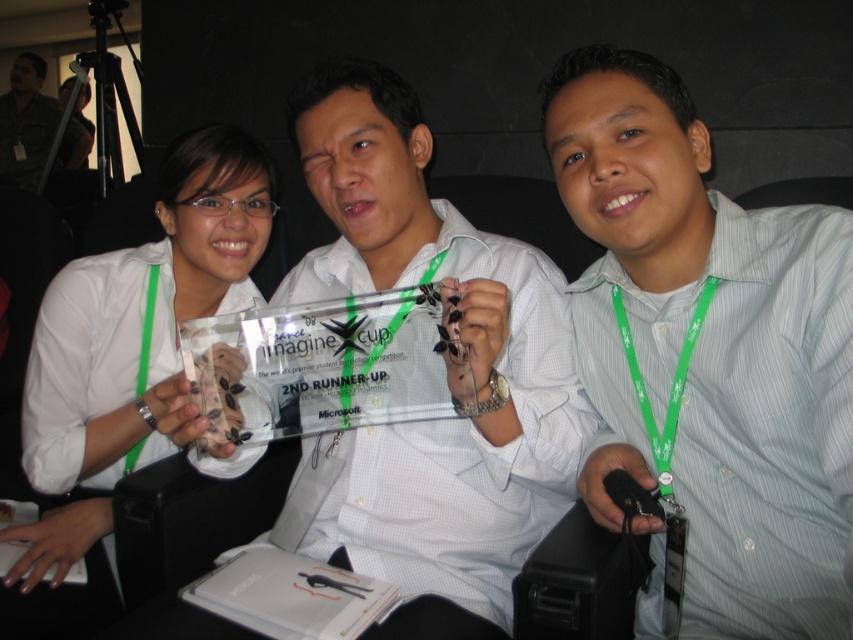
Is point (405, 276) less distant than point (641, 412)?

No, it is not.

Between clear acrylic trophy at center and green fabric lanyard at center, which one is positioned higher?

clear acrylic trophy at center is higher up.

Between point (508, 292) and point (711, 280), which one is positioned in front?

Positioned in front is point (508, 292).

You are a GUI agent. You are given a task and a screenshot of the screen. Output one action in this format:
    pyautogui.click(x=<x>, y=<y>)
    Task: Click on the clear acrylic trophy at center
    Image resolution: width=853 pixels, height=640 pixels.
    Given the screenshot: What is the action you would take?
    pyautogui.click(x=469, y=364)

Is the position of green striped shirt at center more distant than that of green fabric lanyard at center?

No, it is not.

Who is higher up, green striped shirt at center or green fabric lanyard at center?

green striped shirt at center is higher up.

The width and height of the screenshot is (853, 640). What do you see at coordinates (709, 353) in the screenshot?
I see `green striped shirt at center` at bounding box center [709, 353].

Where is `green striped shirt at center`? Image resolution: width=853 pixels, height=640 pixels. green striped shirt at center is located at coordinates (709, 353).

Can you confirm if clear acrylic trophy at center is positioned to the left of matte white trophy at center?

In fact, clear acrylic trophy at center is to the right of matte white trophy at center.

Does point (381, 189) lie behind point (74, 332)?

That is False.

What are the coordinates of `clear acrylic trophy at center` in the screenshot? It's located at (469, 364).

At what (x,y) coordinates should I click in order to perform the action: click on clear acrylic trophy at center. Please return your answer as a coordinate pair (x, y). Looking at the image, I should click on (469, 364).